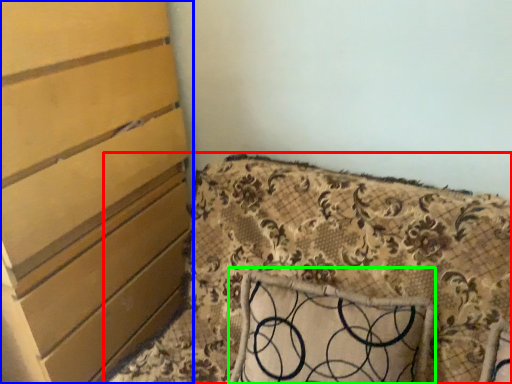
Question: Which object is the farthest from furniture (highlighted by a red box)? Choose among these: chest of drawers (highlighted by a blue box) or pillow (highlighted by a green box).

Choices:
 (A) chest of drawers
 (B) pillow

Answer: (A)